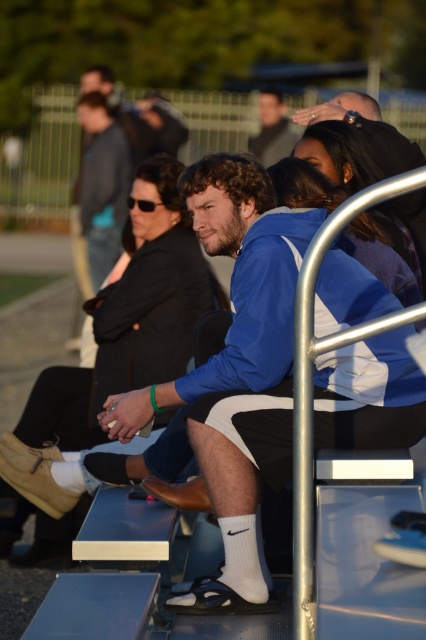
You are standing at the point with coordinates point (x=291, y=131) and want to walk to the point with coordinates point (x=412, y=225). Given the scene described, is the destination point closer to the front or back of the bleachers?

The point (x=412, y=225) is in front of point (x=291, y=131), so the destination point is closer to the front of the bleachers.

You are a fashion designer observing the crowd at the sporting event. You notice two jackets in the center of the image. Which jacket is taller, the blue fleece jacket at center or the matte black jacket at center?

The blue fleece jacket at center is taller than the matte black jacket at center according to the description.

You are at a sports event and want to find the blue fleece jacket at center. Which direction should you look relative to the matte black jacket at center?

The blue fleece jacket at center is located below the matte black jacket at center, so you should look downward from the matte black jacket at center to find it.